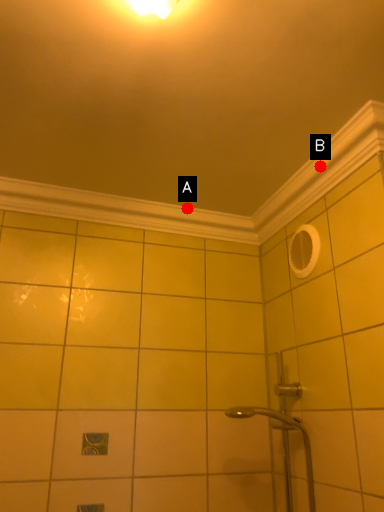
Question: Two points are circled on the image, labeled by A and B beside each circle. Which point is closer to the camera?

Choices:
 (A) A is closer
 (B) B is closer

Answer: (B)